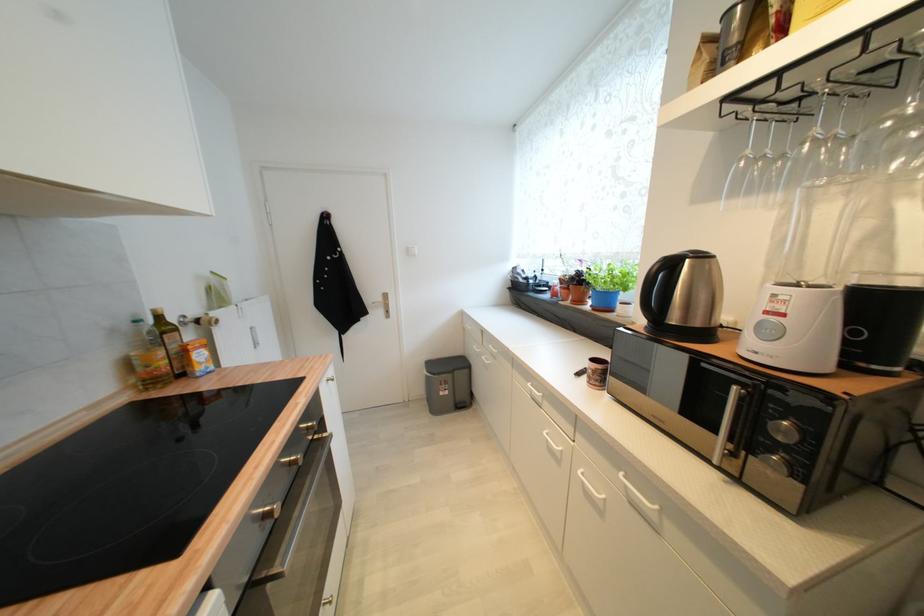
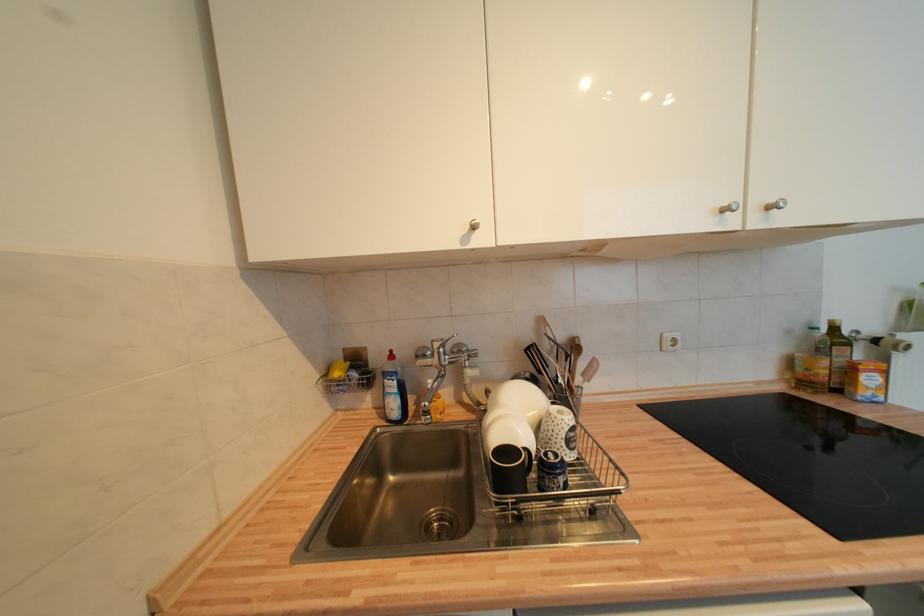
Question: I am providing you with two images of the same scene from different viewpoints. After the viewpoint changes to image2, which objects are now occluded?

Choices:
 (A) clear oil bottle
 (B) silver cabinet knob
 (C) wooden utensil handle
 (D) none of these

Answer: (D)